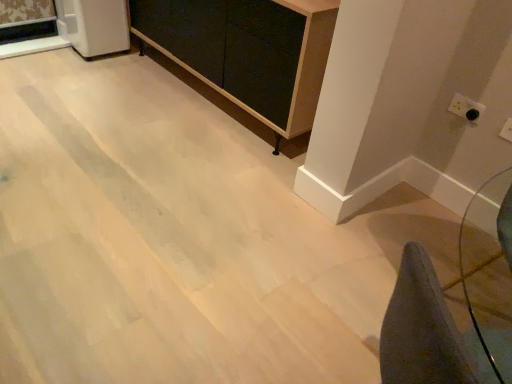
Measure the distance between matte black chalkboard at center and camera.

The distance of matte black chalkboard at center from camera is 1.69 meters.

How much space does white plastic electric outlet at upper right, the second electric outlet in the right-to-left sequence, occupy vertically?

The height of white plastic electric outlet at upper right, the second electric outlet in the right-to-left sequence, is 9.18 centimeters.

Where is `white glossy refrigerator at upper left`? This screenshot has height=384, width=512. white glossy refrigerator at upper left is located at coordinates (94, 26).

This screenshot has height=384, width=512. What are the coordinates of `appliance located behind the matte black chalkboard at center` in the screenshot? It's located at (94, 26).

Would you say matte black chalkboard at center is to the left or to the right of white glossy refrigerator at upper left in the picture?

In the image, matte black chalkboard at center appears on the right side of white glossy refrigerator at upper left.

Is matte black chalkboard at center not near white glossy refrigerator at upper left?

matte black chalkboard at center is near white glossy refrigerator at upper left, not far away.

From the image's perspective, between matte black chalkboard at center and white glossy refrigerator at upper left, which one is located above?

white glossy refrigerator at upper left appears higher in the image.

Could you tell me if matte black chalkboard at center is turned towards white plastic electric outlet at upper right, the 2th electric outlet viewed from the back?

No, matte black chalkboard at center is not facing towards white plastic electric outlet at upper right, the 2th electric outlet viewed from the back.

Is point (227, 62) farther from camera compared to point (510, 129)?

That is True.

Considering the sizes of matte black chalkboard at center and white plastic electric outlet at upper right, the 2th electric outlet viewed from the back, in the image, is matte black chalkboard at center wider or thinner than white plastic electric outlet at upper right, the 2th electric outlet viewed from the back,?

In the image, matte black chalkboard at center appears to be wider than white plastic electric outlet at upper right, the 2th electric outlet viewed from the back.

From their relative heights in the image, would you say white glossy refrigerator at upper left is taller or shorter than white plastic electric outlet at upper right, the first electric outlet in the back-to-front sequence?

white glossy refrigerator at upper left is taller than white plastic electric outlet at upper right, the first electric outlet in the back-to-front sequence.

Can you see white glossy refrigerator at upper left touching white plastic electric outlet at upper right, the second electric outlet in the right-to-left sequence?

No, white glossy refrigerator at upper left is not touching white plastic electric outlet at upper right, the second electric outlet in the right-to-left sequence.

From the picture: Which is more to the right, white glossy refrigerator at upper left or white plastic electric outlet at upper right, which appears as the second electric outlet when viewed from the front?

white plastic electric outlet at upper right, which appears as the second electric outlet when viewed from the front, is more to the right.

Is white plastic electric outlet at upper right, placed as the 1th electric outlet when sorted from front to back, smaller than white plastic electric outlet at upper right, the first electric outlet in the back-to-front sequence?

Yes, white plastic electric outlet at upper right, placed as the 1th electric outlet when sorted from front to back, is smaller than white plastic electric outlet at upper right, the first electric outlet in the back-to-front sequence.

How many degrees apart are the facing directions of white plastic electric outlet at upper right, arranged as the 2th electric outlet when viewed from the top, and white plastic electric outlet at upper right, which appears as the second electric outlet when viewed from the front?

The angle between the facing direction of white plastic electric outlet at upper right, arranged as the 2th electric outlet when viewed from the top, and the facing direction of white plastic electric outlet at upper right, which appears as the second electric outlet when viewed from the front, is 0.0727 degrees.

Between point (507, 126) and point (477, 107), which one is positioned behind?

The point (477, 107) is farther.

Considering the relative sizes of white plastic electric outlet at upper right, positioned as the 1th electric outlet in bottom-to-top order, and white plastic electric outlet at upper right, the first electric outlet in the back-to-front sequence, in the image provided, is white plastic electric outlet at upper right, positioned as the 1th electric outlet in bottom-to-top order, wider than white plastic electric outlet at upper right, the first electric outlet in the back-to-front sequence,?

Incorrect, the width of white plastic electric outlet at upper right, positioned as the 1th electric outlet in bottom-to-top order, does not surpass that of white plastic electric outlet at upper right, the first electric outlet in the back-to-front sequence.

In the scene shown: From a real-world perspective, is white plastic electric outlet at upper right, which is counted as the first electric outlet, starting from the top, physically below white plastic electric outlet at upper right, the 2th electric outlet viewed from the back?

No, from a real-world perspective, white plastic electric outlet at upper right, which is counted as the first electric outlet, starting from the top, is not beneath white plastic electric outlet at upper right, the 2th electric outlet viewed from the back.

Is white plastic electric outlet at upper right, the 1th electric outlet from the left, far away from white plastic electric outlet at upper right, which is the 1th electric outlet from right to left?

No, there isn't a large distance between white plastic electric outlet at upper right, the 1th electric outlet from the left, and white plastic electric outlet at upper right, which is the 1th electric outlet from right to left.

Does white plastic electric outlet at upper right, the second electric outlet in the right-to-left sequence, have a lesser height compared to white plastic electric outlet at upper right, which is the 2th electric outlet from left to right?

Incorrect, the height of white plastic electric outlet at upper right, the second electric outlet in the right-to-left sequence, does not fall short of that of white plastic electric outlet at upper right, which is the 2th electric outlet from left to right.

Is white plastic electric outlet at upper right, the first electric outlet in the back-to-front sequence, oriented away from white plastic electric outlet at upper right, which is the 1th electric outlet from right to left?

No, white plastic electric outlet at upper right, which is the 1th electric outlet from right to left, is not at the back of white plastic electric outlet at upper right, the first electric outlet in the back-to-front sequence.

How different are the orientations of white plastic electric outlet at upper right, which appears as the second electric outlet when viewed from the front, and matte black chalkboard at center in degrees?

0.441 degrees.

Where is `furniture in front of the white plastic electric outlet at upper right, the second electric outlet in the right-to-left sequence`? This screenshot has width=512, height=384. furniture in front of the white plastic electric outlet at upper right, the second electric outlet in the right-to-left sequence is located at coordinates (247, 51).

Is white plastic electric outlet at upper right, placed as the 2th electric outlet when sorted from bottom to top, positioned beyond the bounds of matte black chalkboard at center?

Yes, white plastic electric outlet at upper right, placed as the 2th electric outlet when sorted from bottom to top, is located beyond the bounds of matte black chalkboard at center.

From the picture: From a real-world perspective, is white plastic electric outlet at upper right, which appears as the second electric outlet when viewed from the front, located beneath matte black chalkboard at center?

No, from a real-world perspective, white plastic electric outlet at upper right, which appears as the second electric outlet when viewed from the front, is not below matte black chalkboard at center.

Is white plastic electric outlet at upper right, arranged as the 2th electric outlet when viewed from the top, closer to the viewer compared to matte black chalkboard at center?

Yes, it is.

Based on the photo, considering the relative sizes of white plastic electric outlet at upper right, which is the 2th electric outlet from left to right, and matte black chalkboard at center in the image provided, is white plastic electric outlet at upper right, which is the 2th electric outlet from left to right, bigger than matte black chalkboard at center?

No.

From a real-world perspective, is white plastic electric outlet at upper right, positioned as the 1th electric outlet in bottom-to-top order, positioned under matte black chalkboard at center based on gravity?

Actually, white plastic electric outlet at upper right, positioned as the 1th electric outlet in bottom-to-top order, is physically above matte black chalkboard at center in the real world.

Identify the location of furniture that appears above the white glossy refrigerator at upper left (from a real-world perspective). (247, 51).

Where is `furniture below the white plastic electric outlet at upper right, which is the 1th electric outlet from right to left (from a real-world perspective)`? furniture below the white plastic electric outlet at upper right, which is the 1th electric outlet from right to left (from a real-world perspective) is located at coordinates (247, 51).

Estimate the real-world distances between objects in this image. Which object is further from matte black chalkboard at center, white plastic electric outlet at upper right, placed as the 2th electric outlet when sorted from bottom to top, or white plastic electric outlet at upper right, positioned as the 1th electric outlet in bottom-to-top order?

white plastic electric outlet at upper right, positioned as the 1th electric outlet in bottom-to-top order, lies further to matte black chalkboard at center than the other object.

Based on their spatial positions, is white plastic electric outlet at upper right, placed as the 2th electric outlet when sorted from bottom to top, or matte black chalkboard at center closer to white plastic electric outlet at upper right, the 2th electric outlet viewed from the back?

white plastic electric outlet at upper right, placed as the 2th electric outlet when sorted from bottom to top, lies closer to white plastic electric outlet at upper right, the 2th electric outlet viewed from the back, than the other object.

Estimate the real-world distances between objects in this image. Which object is closer to white plastic electric outlet at upper right, which appears as the second electric outlet when viewed from the front, matte black chalkboard at center or white plastic electric outlet at upper right, placed as the 1th electric outlet when sorted from front to back?

white plastic electric outlet at upper right, placed as the 1th electric outlet when sorted from front to back, lies closer to white plastic electric outlet at upper right, which appears as the second electric outlet when viewed from the front, than the other object.

Based on their spatial positions, is white plastic electric outlet at upper right, placed as the 1th electric outlet when sorted from front to back, or matte black chalkboard at center further from white glossy refrigerator at upper left?

white plastic electric outlet at upper right, placed as the 1th electric outlet when sorted from front to back, is positioned further to the anchor white glossy refrigerator at upper left.

Estimate the real-world distances between objects in this image. Which object is closer to matte black chalkboard at center, white plastic electric outlet at upper right, which is counted as the first electric outlet, starting from the top, or white glossy refrigerator at upper left?

white glossy refrigerator at upper left is positioned closer to the anchor matte black chalkboard at center.

Which object lies nearer to the anchor point white glossy refrigerator at upper left, white plastic electric outlet at upper right, which is counted as the first electric outlet, starting from the top, or matte black chalkboard at center?

Among the two, matte black chalkboard at center is located nearer to white glossy refrigerator at upper left.

From the image, which object appears to be farther from matte black chalkboard at center, white glossy refrigerator at upper left or white plastic electric outlet at upper right, which is the 1th electric outlet from right to left?

white plastic electric outlet at upper right, which is the 1th electric outlet from right to left.

Which object lies further to the anchor point white plastic electric outlet at upper right, which is counted as the first electric outlet, starting from the top, white plastic electric outlet at upper right, positioned as the 1th electric outlet in bottom-to-top order, or matte black chalkboard at center?

The object further to white plastic electric outlet at upper right, which is counted as the first electric outlet, starting from the top, is matte black chalkboard at center.

I want to click on electric outlet located between matte black chalkboard at center and white plastic electric outlet at upper right, positioned as the 1th electric outlet in bottom-to-top order, in the left-right direction, so click(466, 108).

This screenshot has height=384, width=512. I want to click on furniture situated between white glossy refrigerator at upper left and white plastic electric outlet at upper right, the first electric outlet in the back-to-front sequence, from left to right, so click(x=247, y=51).

The width and height of the screenshot is (512, 384). Identify the location of electric outlet between white glossy refrigerator at upper left and white plastic electric outlet at upper right, arranged as the 2th electric outlet when viewed from the top, from left to right. (466, 108).

You are a GUI agent. You are given a task and a screenshot of the screen. Output one action in this format:
    pyautogui.click(x=<x>, y=<y>)
    Task: Click on the furniture situated between white glossy refrigerator at upper left and white plastic electric outlet at upper right, arranged as the 2th electric outlet when viewed from the top, from left to right
    
    Given the screenshot: What is the action you would take?
    pyautogui.click(x=247, y=51)